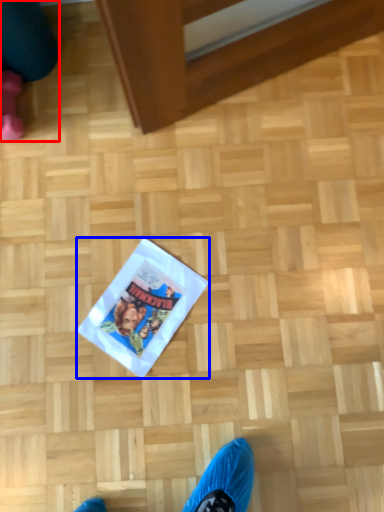
Question: Which object appears closest to the camera in this image, leg (highlighted by a red box) or flyer (highlighted by a blue box)?

Choices:
 (A) leg
 (B) flyer

Answer: (A)